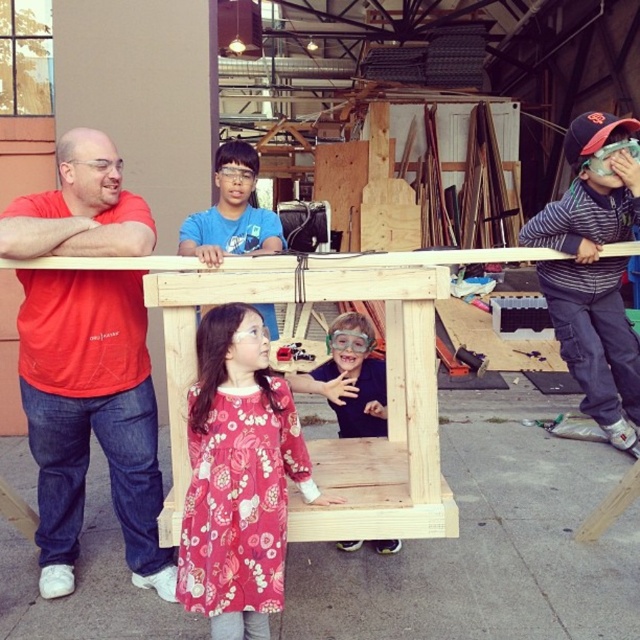
From the picture: Please look at the image. There is a wooden structure being assembled in the foreground. A young girl in a red floral dress stands in front of it, and a boy in a navy blue shirt is partially hidden behind the structure. Now, I want to know the location of the point with coordinates point (230,212). Based on the scene description, can you tell me which object this point corresponds to?

The point (230,212) corresponds to the blue cotton shirt at upper center.

You are a photographer in the workshop and want to take a photo of the pink floral dress at center and the blue cotton shirt at upper center. Which object should you focus on first if you want to capture both in the same frame without moving the camera?

The pink floral dress at center is positioned under the blue cotton shirt at upper center, so you should focus on the blue cotton shirt at upper center first as it is higher in the frame, allowing both to be in the same frame without moving the camera.